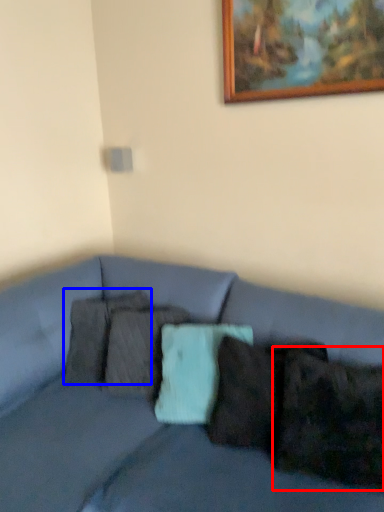
Question: Which of the following is the farthest to the observer, pillow (highlighted by a red box) or pillow (highlighted by a blue box)?

Choices:
 (A) pillow
 (B) pillow

Answer: (B)